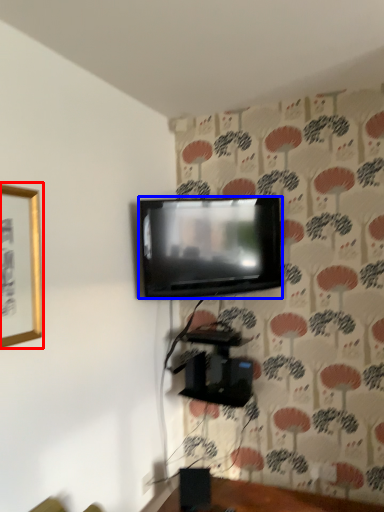
Question: Which object is closer to the camera taking this photo, picture frame (highlighted by a red box) or television (highlighted by a blue box)?

Choices:
 (A) picture frame
 (B) television

Answer: (A)